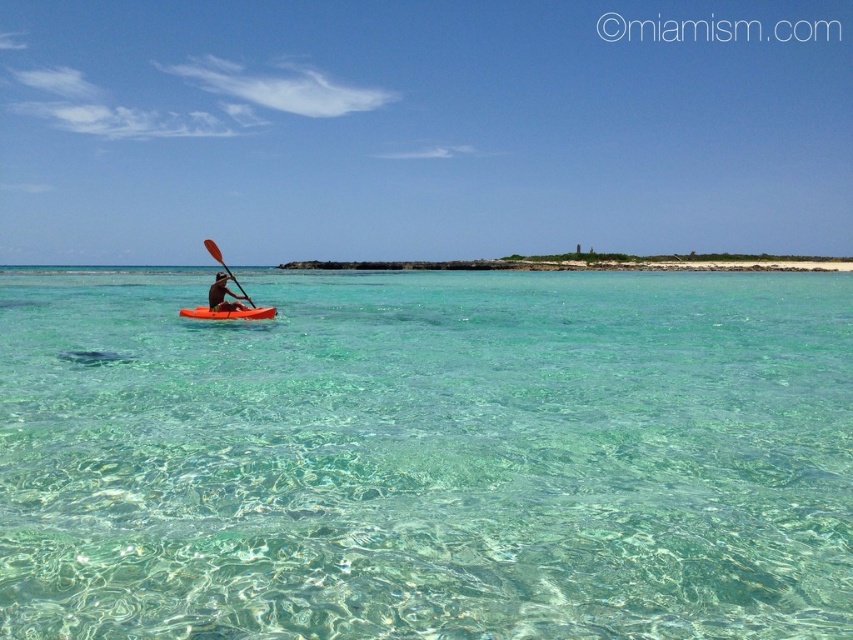
Image resolution: width=853 pixels, height=640 pixels. Describe the element at coordinates (223, 296) in the screenshot. I see `matte orange kayak at center` at that location.

At what (x,y) coordinates should I click in order to perform the action: click on matte orange kayak at center. Please return your answer as a coordinate pair (x, y). This screenshot has width=853, height=640. Looking at the image, I should click on (223, 296).

Is point (263, 307) behind point (236, 284)?

Yes, it is.

Does orange plastic canoe at center have a greater height compared to wooden paddle at center?

In fact, orange plastic canoe at center may be shorter than wooden paddle at center.

The width and height of the screenshot is (853, 640). What are the coordinates of `orange plastic canoe at center` in the screenshot? It's located at (228, 314).

Does clear glassy water at center have a smaller size compared to matte orange kayak at center?

No.

How far apart are clear glassy water at center and matte orange kayak at center?

A distance of 28.97 feet exists between clear glassy water at center and matte orange kayak at center.

Who is more distant from viewer, (434,552) or (210,285)?

Positioned behind is point (210,285).

Identify the location of clear glassy water at center. The image size is (853, 640). (426, 456).